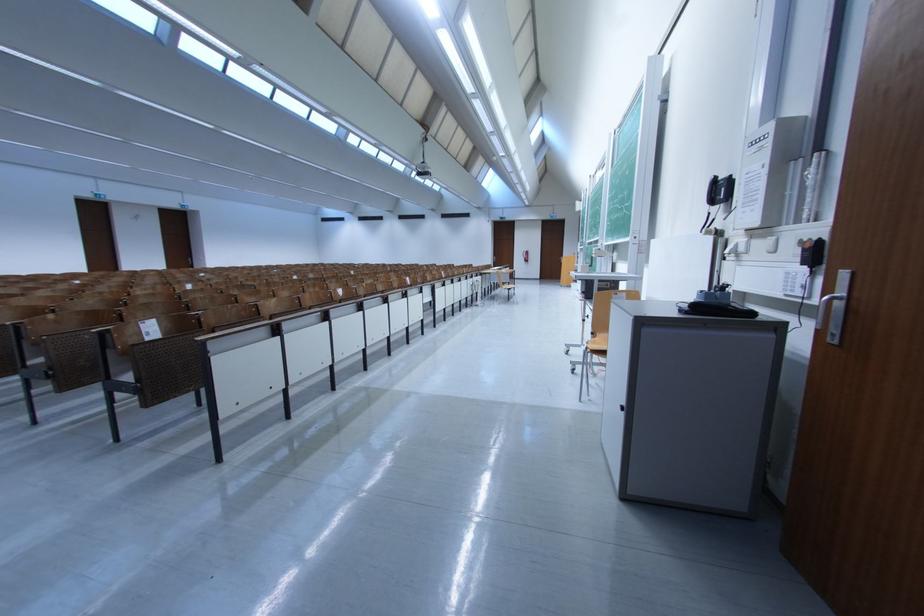
Locate an element on the screen. red fire extinguisher is located at coordinates (526, 256).